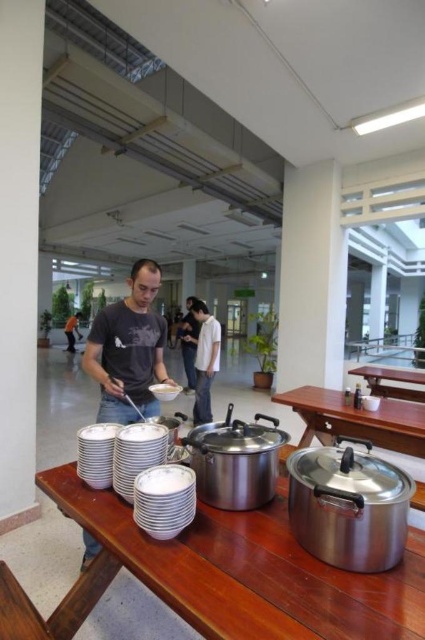
Question: Which is farther from the dark gray t-shirt at center?

Choices:
 (A) orange fabric shirt at center
 (B) white cotton shirt at center
 (C) wooden table at center

Answer: (A)

Question: Is stainless steel pots at center to the right of white cotton shirt at center from the viewer's perspective?

Choices:
 (A) yes
 (B) no

Answer: (A)

Question: Does matte gray shirt at center appear on the right side of stainless steel pots at center?

Choices:
 (A) yes
 (B) no

Answer: (B)

Question: Does stainless steel pots at center have a lesser width compared to white matte bowl at center?

Choices:
 (A) yes
 (B) no

Answer: (B)

Question: Among these objects, which one is nearest to the camera?

Choices:
 (A) orange fabric shirt at center
 (B) white matte bowl at center

Answer: (B)

Question: Which point is closer to the camera?

Choices:
 (A) (153, 384)
 (B) (70, 339)
 (C) (192, 328)
 (D) (323, 413)

Answer: (A)